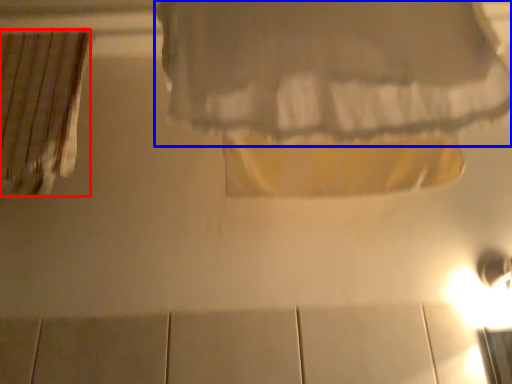
Question: Which point is closer to the camera, curtain (highlighted by a red box) or curtain (highlighted by a blue box)?

Choices:
 (A) curtain
 (B) curtain

Answer: (B)